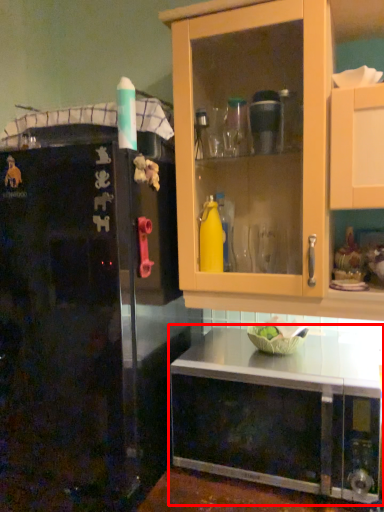
Question: From the image, what is the correct spatial relationship of cabinetry (annotated by the red box) in relation to refrigerator?

Choices:
 (A) right
 (B) left

Answer: (A)